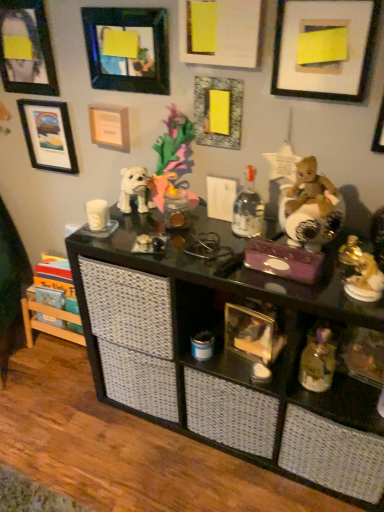
Question: Is the depth of shiny gold bear at right, the fourth toy positioned from the bottom, greater than that of matte white picture frame at upper left, placed as the 3th picture frame when sorted from left to right?

Choices:
 (A) yes
 (B) no

Answer: (B)

Question: Is shiny gold bear at right, the fourth toy positioned from the bottom, looking in the opposite direction of matte white picture frame at upper left, placed as the 3th picture frame when sorted from left to right?

Choices:
 (A) yes
 (B) no

Answer: (B)

Question: Are shiny gold bear at right, positioned as the first toy in top-to-bottom order, and matte white picture frame at upper left, placed as the 3th picture frame when sorted from left to right, making contact?

Choices:
 (A) no
 (B) yes

Answer: (A)

Question: From a real-world perspective, is shiny gold bear at right, the fourth toy positioned from the bottom, physically above matte white picture frame at upper left, arranged as the 6th picture frame when viewed from the right?

Choices:
 (A) no
 (B) yes

Answer: (A)

Question: From a real-world perspective, is shiny gold bear at right, positioned as the first toy in top-to-bottom order, beneath matte white picture frame at upper left, arranged as the 6th picture frame when viewed from the right?

Choices:
 (A) yes
 (B) no

Answer: (A)

Question: Is shiny gold bear at right, positioned as the first toy in top-to-bottom order, aimed at matte white picture frame at upper left, placed as the 3th picture frame when sorted from left to right?

Choices:
 (A) no
 (B) yes

Answer: (A)

Question: Does black glass shelf at center have a greater width compared to gold metallic figurine at right, marked as the 3th toy in a bottom-to-top arrangement?

Choices:
 (A) no
 (B) yes

Answer: (B)

Question: From the image's perspective, is black glass shelf at center under gold metallic figurine at right, acting as the second toy starting from the top?

Choices:
 (A) yes
 (B) no

Answer: (A)

Question: Is black glass shelf at center smaller than gold metallic figurine at right, marked as the 3th toy in a bottom-to-top arrangement?

Choices:
 (A) yes
 (B) no

Answer: (B)

Question: Can you confirm if black glass shelf at center is taller than gold metallic figurine at right, acting as the second toy starting from the top?

Choices:
 (A) yes
 (B) no

Answer: (A)

Question: Is black glass shelf at center not near gold metallic figurine at right, marked as the 3th toy in a bottom-to-top arrangement?

Choices:
 (A) no
 (B) yes

Answer: (A)

Question: Is black glass shelf at center behind gold metallic figurine at right, acting as the second toy starting from the top?

Choices:
 (A) yes
 (B) no

Answer: (B)

Question: Considering the relative sizes of matte black picture frame at upper left, the eighth picture frame from the right, and matte yellow paper at center, the 3th picture frame positioned from the right, in the image provided, is matte black picture frame at upper left, the eighth picture frame from the right, wider than matte yellow paper at center, the 3th picture frame positioned from the right,?

Choices:
 (A) no
 (B) yes

Answer: (A)